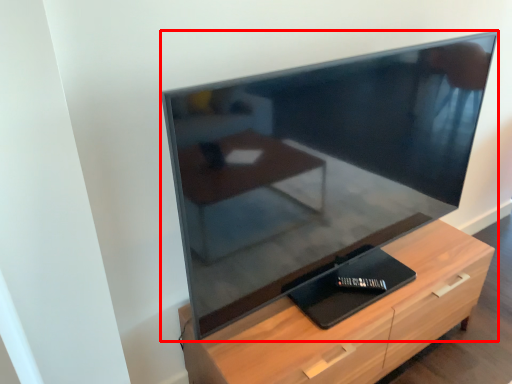
Question: Observing the image, what is the correct spatial positioning of television (annotated by the red box) in reference to chest of drawers?

Choices:
 (A) right
 (B) left

Answer: (B)